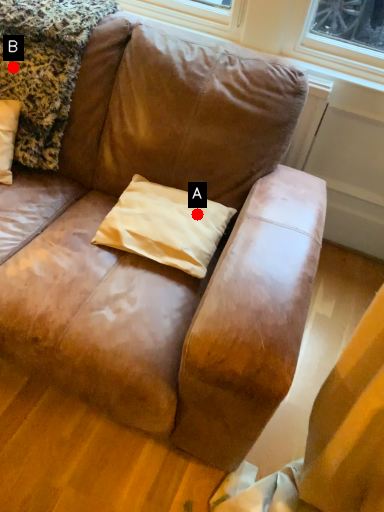
Question: Two points are circled on the image, labeled by A and B beside each circle. Which of the following is the farthest from the observer?

Choices:
 (A) A is further
 (B) B is further

Answer: (B)